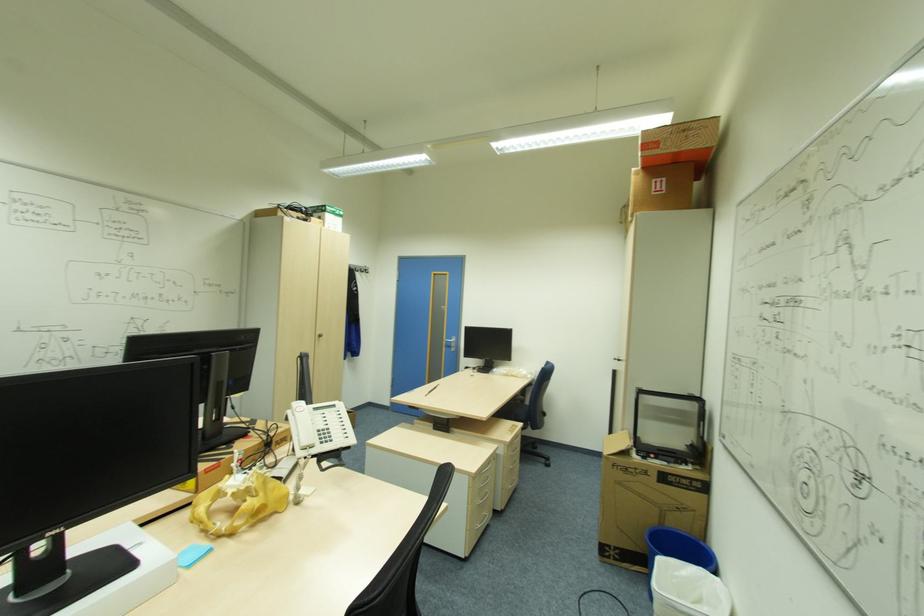
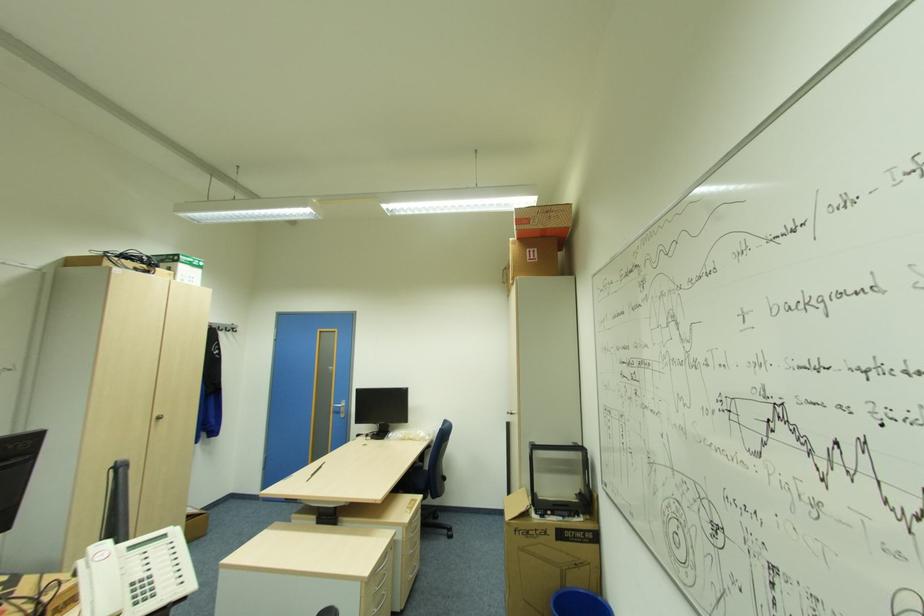
Question: In a continuous first-person perspective shot, in which direction is the camera moving?

Choices:
 (A) Left
 (B) Right
 (C) Forward
 (D) Backward

Answer: (C)